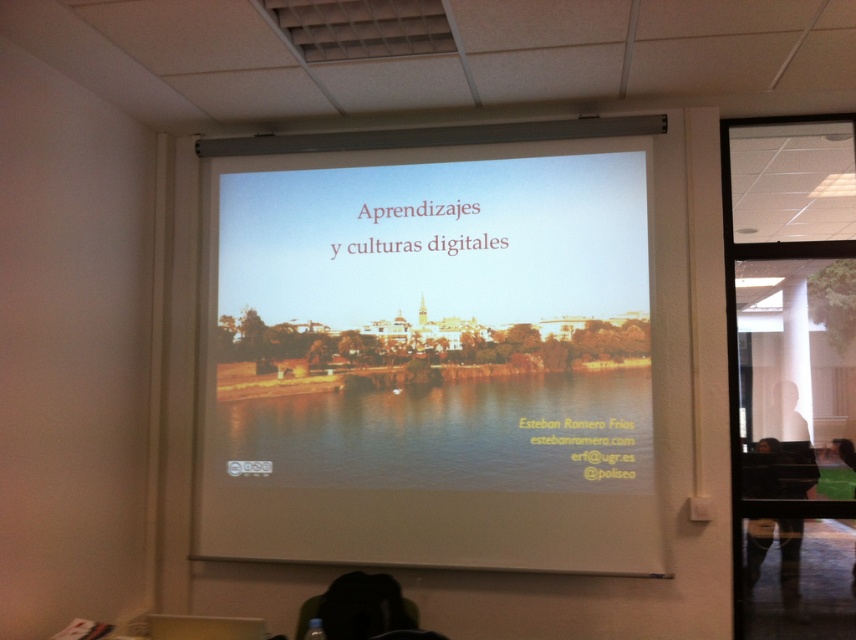
You are a student in the classroom and want to take a photo of the presentation on the white glossy projector screen at center. However, you notice someone with dark hair at lower right. What should you be cautious about when taking the photo?

You should be cautious of the dark hair at lower right because the white glossy projector screen at center is above it, so the person might block the lower part of the screen in your photo.

You are a student attending a presentation and need to take a photo of the slide on the white glossy projector screen at center. However, there is a person with dark hair at lower right in the way. Can you estimate if the person is blocking the entire screen?

The white glossy projector screen at center is larger in size than dark hair at lower right, so the person with dark hair at lower right is not blocking the entire screen. You can still capture parts of the slide by moving slightly to the side or adjusting your angle.

What object is located at the coordinates point (431, 356) in the image?

The point (431, 356) corresponds to the white glossy projector screen at center.